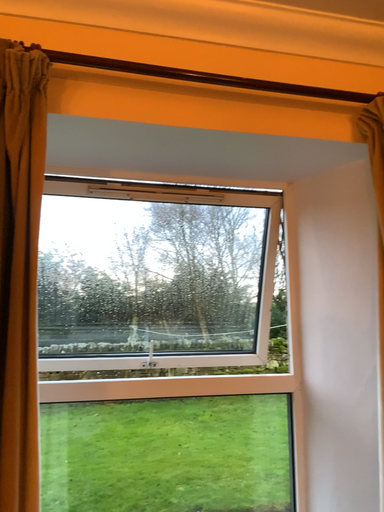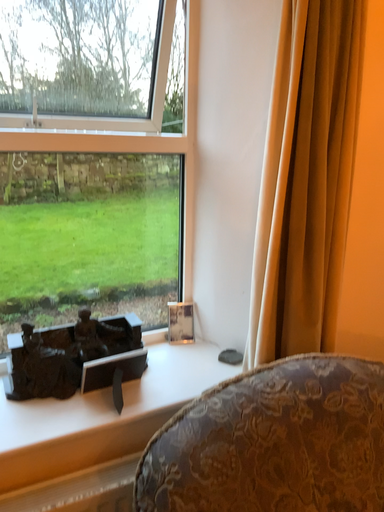
Question: Which way did the camera rotate in the video?

Choices:
 (A) rotated left
 (B) rotated right

Answer: (B)